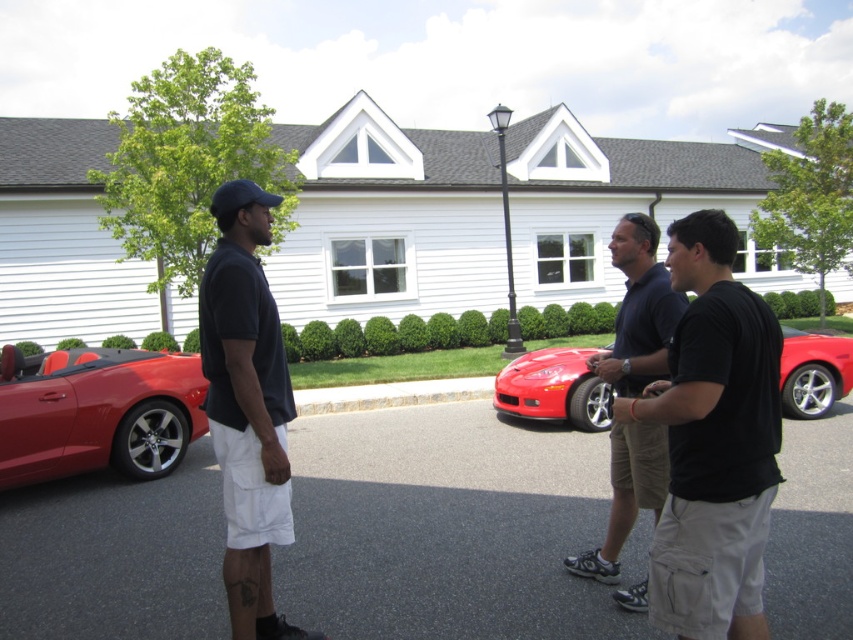
Question: Which of the following is the farthest from the observer?

Choices:
 (A) glossy metallic sports car at center
 (B) shiny red convertible at left
 (C) asphalt at lower center
 (D) glossy red sports car at center

Answer: (A)

Question: In this image, where is shiny red convertible at left located relative to matte black shirt at center?

Choices:
 (A) right
 (B) left

Answer: (B)

Question: Is asphalt at lower center to the left of glossy metallic sports car at center from the viewer's perspective?

Choices:
 (A) no
 (B) yes

Answer: (B)

Question: Among these objects, which one is farthest from the camera?

Choices:
 (A) black cotton t-shirt at center
 (B) glossy metallic sports car at center

Answer: (B)

Question: Is black cotton t-shirt at center below glossy red sports car at center?

Choices:
 (A) no
 (B) yes

Answer: (A)

Question: Which of the following is the farthest from the observer?

Choices:
 (A) (163, 609)
 (B) (24, 387)
 (C) (198, 307)
 (D) (637, 225)

Answer: (C)